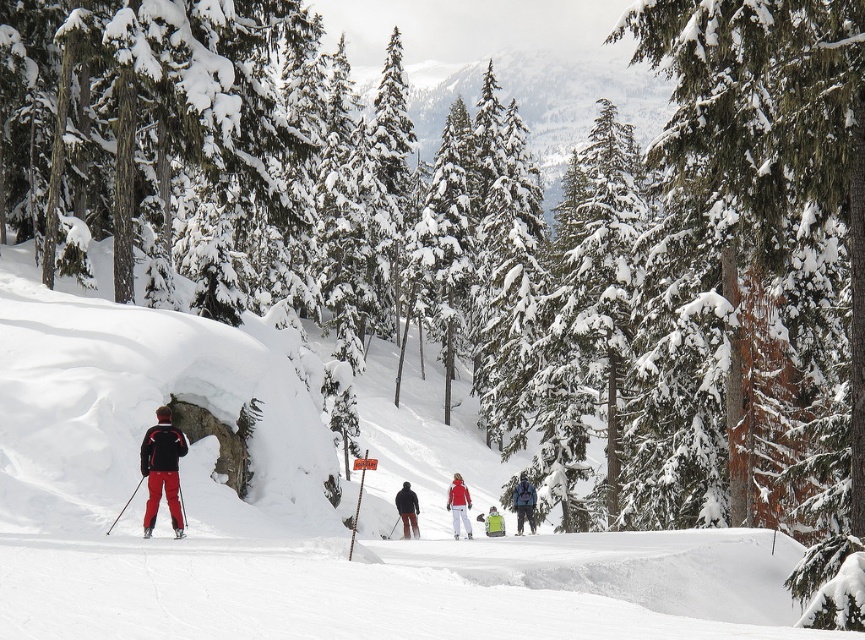
Between point (173, 556) and point (452, 502), which one is positioned behind?

The point (452, 502) is behind.

Does point (101, 460) lie behind point (449, 500)?

No.

Find the location of a particular element. white snow ski slope at left is located at coordinates coord(302,506).

Can you confirm if matte red snowsuit at center is positioned below green fabric backpack at center?

Indeed, matte red snowsuit at center is positioned under green fabric backpack at center.

Measure the distance between matte red snowsuit at center and camera.

matte red snowsuit at center and camera are 34.70 meters apart.

What do you see at coordinates (458, 506) in the screenshot? I see `matte red snowsuit at center` at bounding box center [458, 506].

At what (x,y) coordinates should I click in order to perform the action: click on matte red snowsuit at center. Please return your answer as a coordinate pair (x, y). The width and height of the screenshot is (865, 640). Looking at the image, I should click on (458, 506).

Can you confirm if matte black jacket at center is positioned to the left of matte red ski at lower left?

Incorrect, matte black jacket at center is not on the left side of matte red ski at lower left.

Identify the location of matte black jacket at center. The height and width of the screenshot is (640, 865). pos(407,509).

Is point (402, 525) positioned in front of point (178, 532)?

No, it is not.

This screenshot has width=865, height=640. Find the location of `matte black jacket at center`. matte black jacket at center is located at coordinates (407, 509).